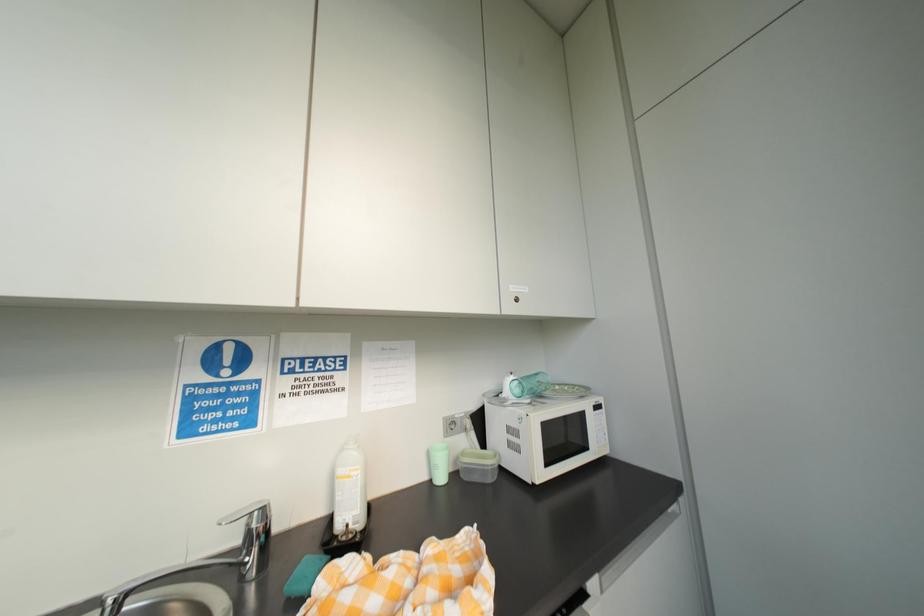
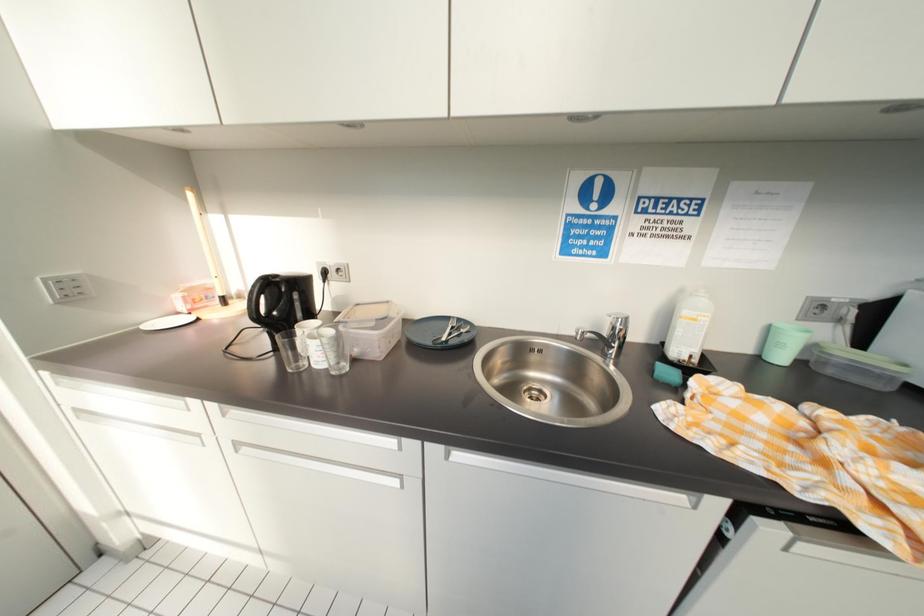
Based on the continuous images, in which direction is the camera rotating?

The camera rotated toward left-down.